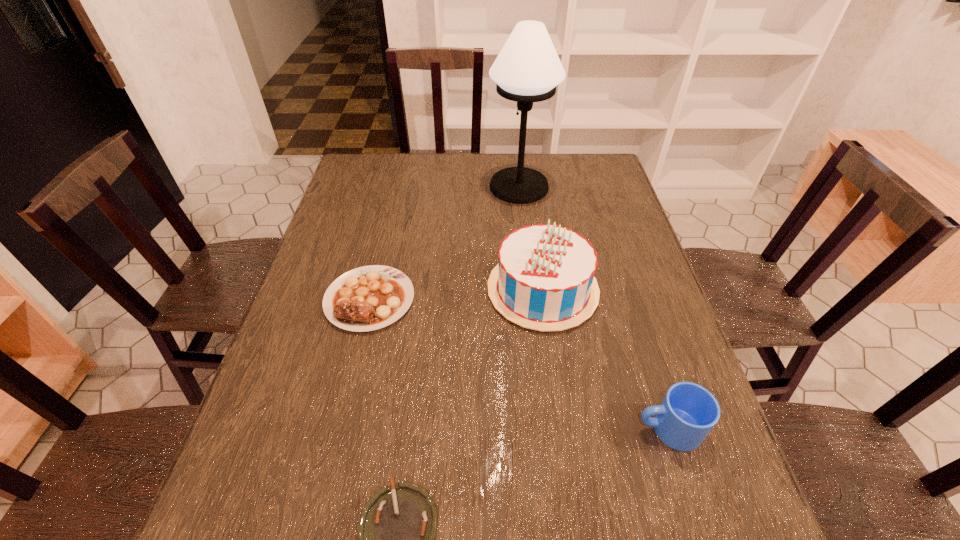
The width and height of the screenshot is (960, 540). Identify the location of the farthest object. (528, 69).

This screenshot has height=540, width=960. In order to click on the tallest object in this screenshot , I will do `click(528, 69)`.

Where is `the second tallest object`? the second tallest object is located at coordinates (544, 281).

Where is `the rightmost object`? This screenshot has width=960, height=540. the rightmost object is located at coordinates click(x=688, y=412).

The image size is (960, 540). Identify the location of the third tallest object. (688, 412).

Find the location of a particular element. The width and height of the screenshot is (960, 540). the second shortest object is located at coordinates coord(368,298).

Where is `vacant space situated on the left of the farthest object`? vacant space situated on the left of the farthest object is located at coordinates (472, 187).

At what (x,y) coordinates should I click in order to perform the action: click on free space located on the left of the second tallest object. Please return your answer as a coordinate pair (x, y). Image resolution: width=960 pixels, height=540 pixels. Looking at the image, I should click on (465, 290).

Locate an element on the screen. This screenshot has height=540, width=960. vacant region located 0.350m on the side of the mug with the handle is located at coordinates (460, 429).

At what (x,y) coordinates should I click in order to perform the action: click on vacant space located 0.360m on the side of the mug with the handle. Please return your answer as a coordinate pair (x, y). The height and width of the screenshot is (540, 960). Looking at the image, I should click on pyautogui.click(x=455, y=429).